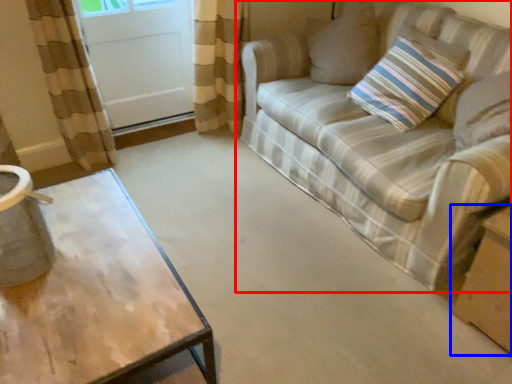
Question: Which point is closer to the camera, studio couch (highlighted by a red box) or cardboard box (highlighted by a blue box)?

Choices:
 (A) studio couch
 (B) cardboard box

Answer: (A)